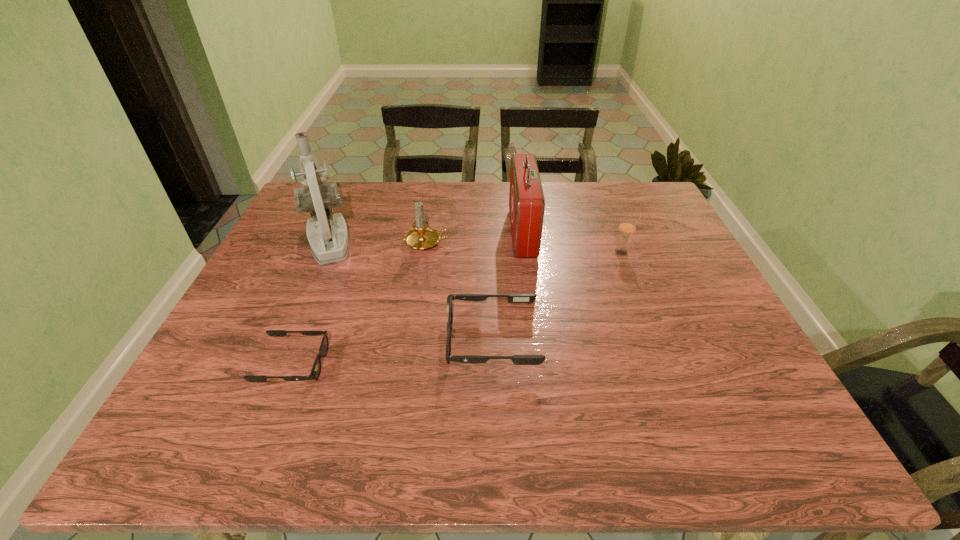
Where is `vacant space situated 0.400m on the temples of the right sunglasses`? This screenshot has height=540, width=960. vacant space situated 0.400m on the temples of the right sunglasses is located at coordinates (270, 341).

You are a GUI agent. You are given a task and a screenshot of the screen. Output one action in this format:
    pyautogui.click(x=<x>, y=<y>)
    Task: Click on the free space located on the temples of the right sunglasses
    The width and height of the screenshot is (960, 540).
    Given the screenshot: What is the action you would take?
    (x=406, y=341)

The width and height of the screenshot is (960, 540). Identify the location of free location located on the side of the first-aid kit with the first aid cross symbol. (447, 233).

The width and height of the screenshot is (960, 540). In order to click on vacant point located 0.240m on the side of the first-aid kit with the first aid cross symbol in this screenshot , I will do `click(430, 233)`.

In order to click on vacant space situated 0.350m on the side of the first-aid kit with the first aid cross symbol in this screenshot , I will do `click(394, 233)`.

I want to click on free spot located 0.260m on the right of the third object from left to right, so 540,242.

The width and height of the screenshot is (960, 540). I want to click on vacant space located on the front of the tallest object, so click(265, 386).

I want to click on vacant space situated on the front of the straw, so click(629, 269).

Where is `object located in the far edge section of the desktop`? Image resolution: width=960 pixels, height=540 pixels. object located in the far edge section of the desktop is located at coordinates (526, 198).

Where is `sunglasses that is at the left edge`? This screenshot has height=540, width=960. sunglasses that is at the left edge is located at coordinates (316, 369).